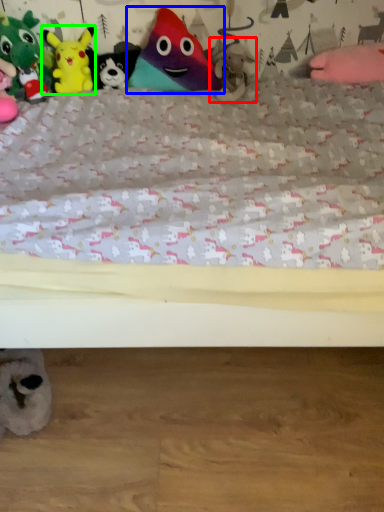
Question: Based on their relative distances, which object is nearer to toy (highlighted by a red box)? Choose from toy (highlighted by a blue box) and toy (highlighted by a green box).

Choices:
 (A) toy
 (B) toy

Answer: (A)